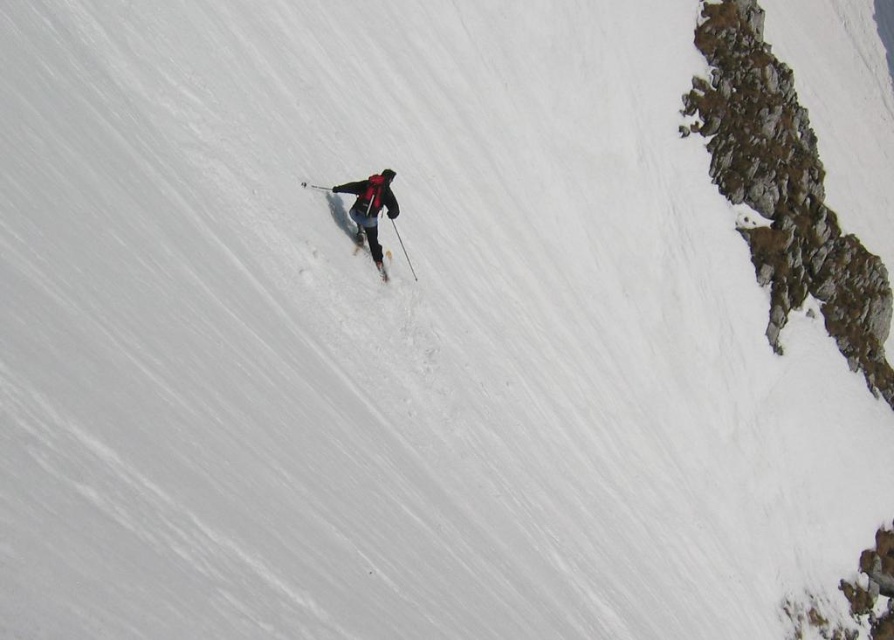
Question: Can you confirm if matte black ski suit at center is smaller than matte black ski at center?

Choices:
 (A) no
 (B) yes

Answer: (A)

Question: Is matte black ski suit at center in front of matte black ski at center?

Choices:
 (A) no
 (B) yes

Answer: (B)

Question: Can you confirm if matte black ski suit at center is positioned above matte black ski at center?

Choices:
 (A) no
 (B) yes

Answer: (B)

Question: Which of the following is the closest to the observer?

Choices:
 (A) (378, 243)
 (B) (361, 248)

Answer: (B)

Question: Among these objects, which one is farthest from the camera?

Choices:
 (A) matte black ski at center
 (B) matte black ski suit at center

Answer: (A)